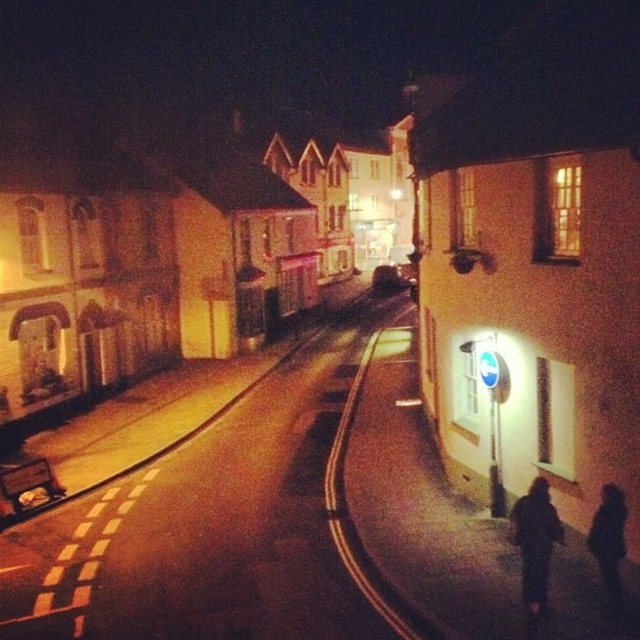
Question: Among these objects, which one is nearest to the camera?

Choices:
 (A) black asphalt road at center
 (B) dark fabric jacket at lower right

Answer: (B)

Question: Is black asphalt road at center thinner than dark fabric jacket at lower right?

Choices:
 (A) yes
 (B) no

Answer: (B)

Question: Which object appears farthest from the camera in this image?

Choices:
 (A) black matte figure at lower right
 (B) black asphalt road at center
 (C) dark fabric jacket at lower right

Answer: (B)

Question: Where is dark fabric jacket at lower right located in relation to black matte figure at lower right in the image?

Choices:
 (A) above
 (B) below

Answer: (B)

Question: Which point is closer to the camera?

Choices:
 (A) (608, 490)
 (B) (269, 387)
 (C) (532, 605)

Answer: (C)

Question: In this image, where is dark fabric jacket at lower right located relative to black matte figure at lower right?

Choices:
 (A) above
 (B) below

Answer: (B)